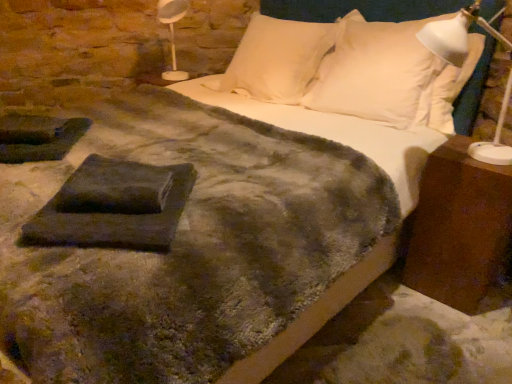
Question: Which direction should I rotate to look at white soft pillow at upper center, the 2th pillow viewed from the right?

Choices:
 (A) right
 (B) left

Answer: (A)

Question: Is white plastic lamp at right not within white plastic table lamp at upper left?

Choices:
 (A) yes
 (B) no

Answer: (A)

Question: Is white plastic lamp at right positioned before white plastic table lamp at upper left?

Choices:
 (A) no
 (B) yes

Answer: (B)

Question: Does white plastic lamp at right have a lesser height compared to white plastic table lamp at upper left?

Choices:
 (A) yes
 (B) no

Answer: (B)

Question: Is white plastic lamp at right wider than white plastic table lamp at upper left?

Choices:
 (A) no
 (B) yes

Answer: (A)

Question: Does white plastic lamp at right have a larger size compared to white plastic table lamp at upper left?

Choices:
 (A) yes
 (B) no

Answer: (A)

Question: From a real-world perspective, is white plastic lamp at right beneath white plastic table lamp at upper left?

Choices:
 (A) no
 (B) yes

Answer: (A)

Question: Is white soft pillow at upper right, which is the first pillow in right-to-left order, positioned beyond the bounds of brown wood nightstand at right?

Choices:
 (A) no
 (B) yes

Answer: (B)

Question: Does white soft pillow at upper right, which is the first pillow in right-to-left order, have a greater height compared to brown wood nightstand at right?

Choices:
 (A) yes
 (B) no

Answer: (A)

Question: Does white soft pillow at upper right, which is the first pillow in right-to-left order, have a smaller size compared to brown wood nightstand at right?

Choices:
 (A) yes
 (B) no

Answer: (B)

Question: From a real-world perspective, is white soft pillow at upper right, which is the first pillow in right-to-left order, physically above brown wood nightstand at right?

Choices:
 (A) no
 (B) yes

Answer: (B)

Question: Would you consider white soft pillow at upper right, which is the second pillow in left-to-right order, to be distant from brown wood nightstand at right?

Choices:
 (A) no
 (B) yes

Answer: (A)

Question: Is brown wood nightstand at right a part of white soft pillow at upper right, which is the second pillow in left-to-right order?

Choices:
 (A) no
 (B) yes

Answer: (A)

Question: From the image's perspective, is dark gray felt at center on white plastic lamp at right?

Choices:
 (A) no
 (B) yes

Answer: (A)